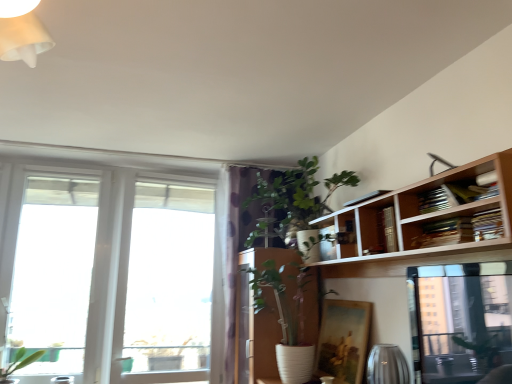
Question: From the image's perspective, relative to wooden bookshelf at upper right, is green leafy plant at upper center above or below?

Choices:
 (A) below
 (B) above

Answer: (B)

Question: Considering their positions, is green leafy plant at upper center located in front of or behind wooden bookshelf at upper right?

Choices:
 (A) behind
 (B) front

Answer: (A)

Question: Which object is positioned farthest from the transparent glass window at left, positioned as the 1th window in right-to-left order?

Choices:
 (A) wooden bookshelf at upper right
 (B) green leafy plant at upper center
 (C) purple dotted fabric at center
 (D) transparent glass window at left, the 1th window viewed from the left

Answer: (A)

Question: Based on their relative distances, which object is farther from the wooden bookshelf at upper right?

Choices:
 (A) transparent glass window at left, the 1th window viewed from the left
 (B) purple dotted fabric at center
 (C) green leafy plant at upper center
 (D) transparent glass window at left, which is the second window in left-to-right order

Answer: (A)